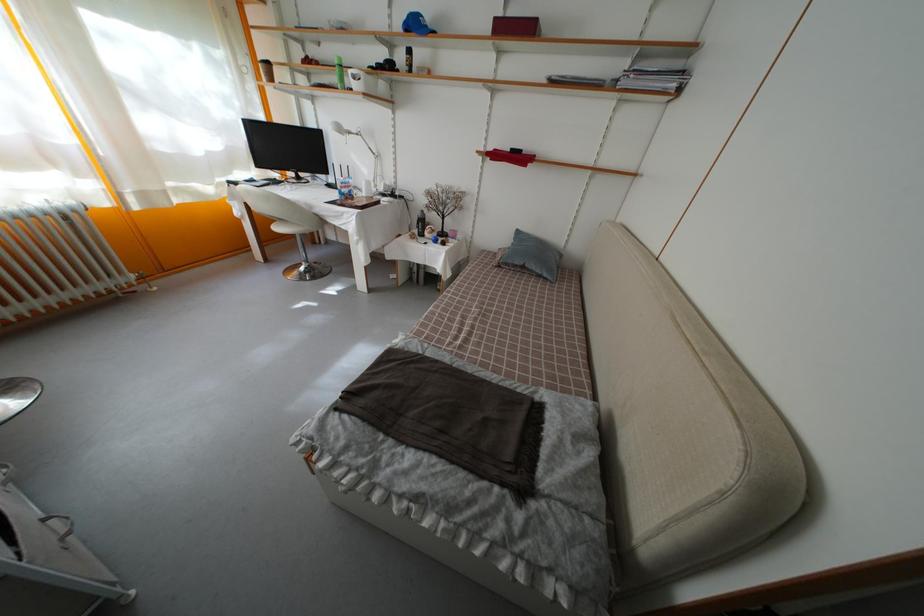
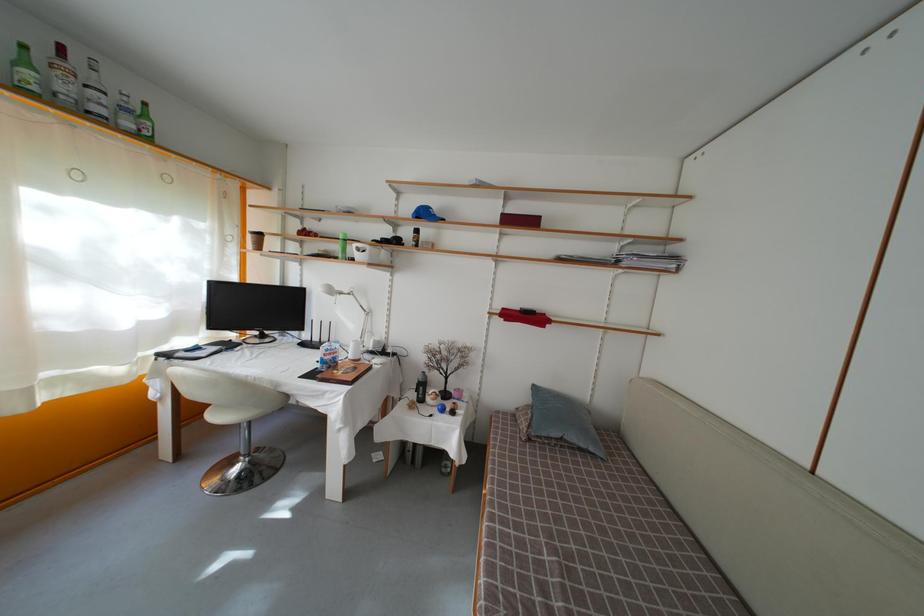
Question: Based on the continuous images, in which direction is the camera rotating? Reply with the corresponding letter.

Choices:
 (A) Left
 (B) Right
 (C) Up
 (D) Down

Answer: (C)